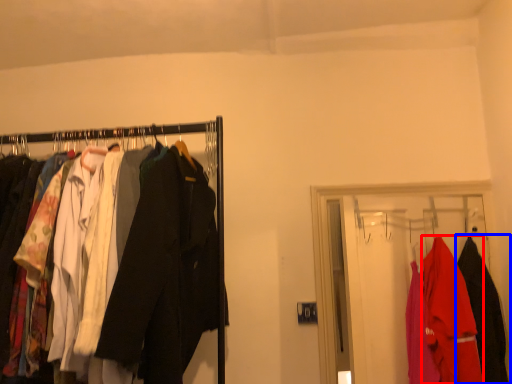
Question: Which object appears closest to the camera in this image, fancy dress (highlighted by a red box) or fancy dress (highlighted by a blue box)?

Choices:
 (A) fancy dress
 (B) fancy dress

Answer: (A)